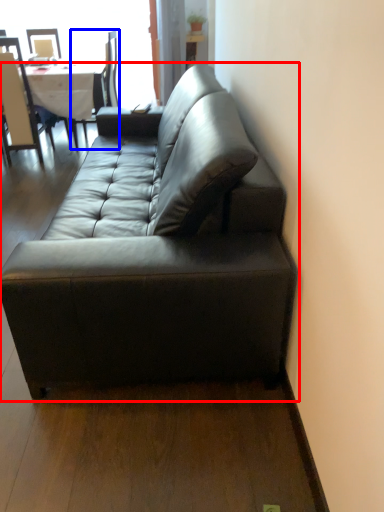
Question: Which object is further to the camera taking this photo, studio couch (highlighted by a red box) or chair (highlighted by a blue box)?

Choices:
 (A) studio couch
 (B) chair

Answer: (B)